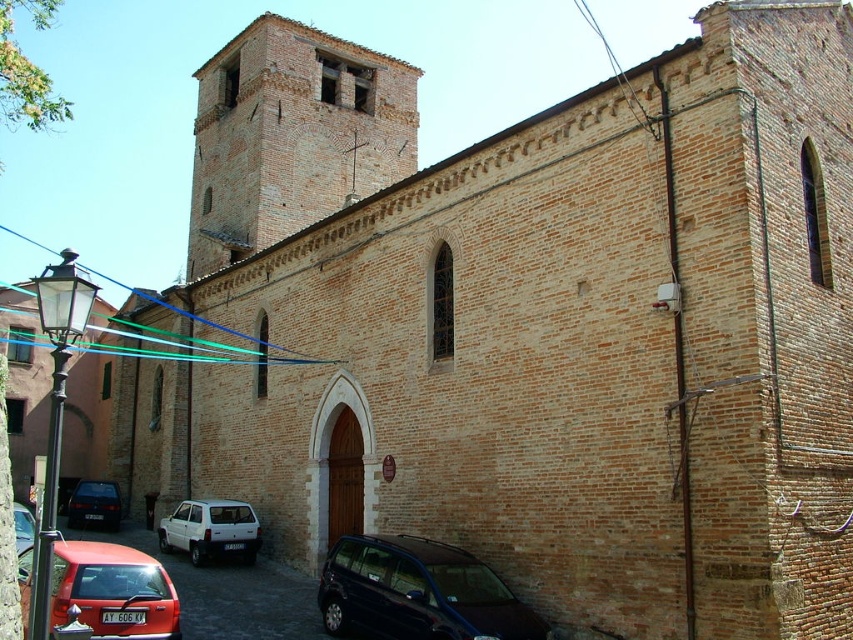
Looking at this image, you are standing in front of the historic brick building and want to determine the relative positions of two points marked on the building. Which point is closer to you, point (288, 154) or point (22, 522)?

Point (288, 154) is further to the viewer than point (22, 522), so point (22, 522) is closer to you.

You are standing in front of a historic brick building. You notice a point marked at coordinates (212, 531). Based on the scene description, can you identify what object this point is located on?

The point at coordinates (212, 531) is located on the white matte hatchback at lower left.

Looking at this image, you are a delivery driver who needs to park your matte red hatchback at lower left near the historic building. However, there is a brown brick tower at upper center in the way. Can you safely park your car without blocking the entrance of the building?

The brown brick tower at upper center is positioned on the left side of matte red hatchback at lower left. Since the tower is to the left of the car, it does not block the entrance of the building. Therefore, you can safely park your matte red hatchback at lower left without obstructing the entrance.